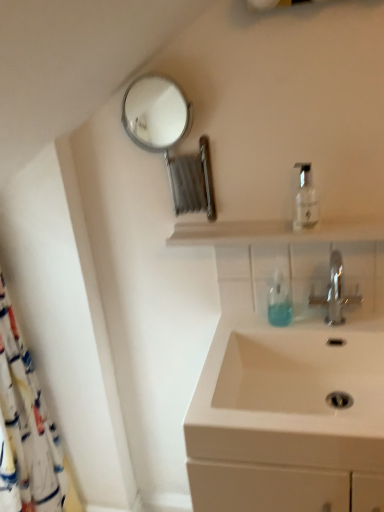
Locate an element on the screen. The image size is (384, 512). free space to the left of clear plastic bottle at upper right is located at coordinates (261, 227).